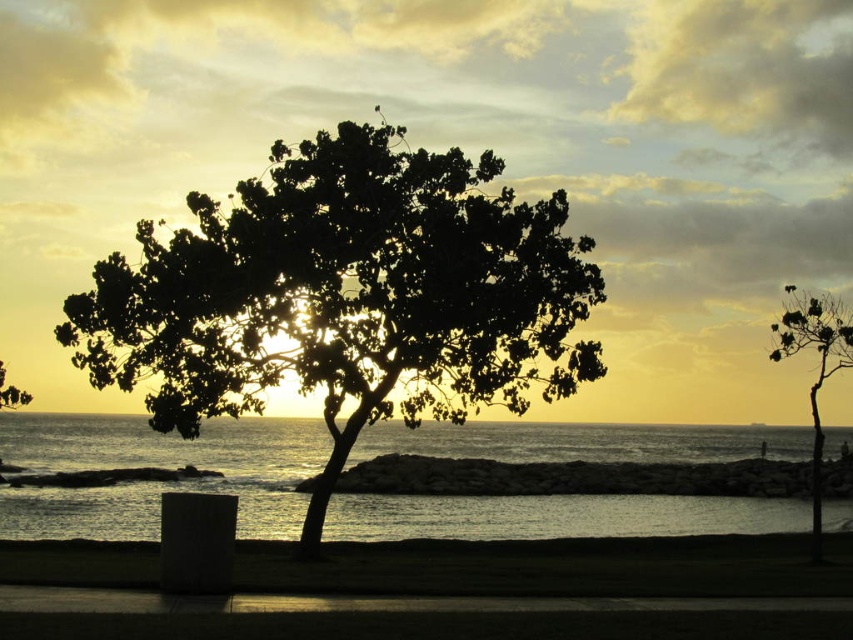
You are a photographer trying to capture the sunset. You notice the silhouette leafy tree at center and the silvery water at center. Which object is positioned higher in the scene?

The silhouette leafy tree at center is located above the silvery water at center, so it is positioned higher in the scene.

You are an artist trying to paint the coastal sunset scene. You notice the silhouette leafy tree at center and the silvery water at center. Which object in the scene has a narrower width?

The silhouette leafy tree at center is thinner than the silvery water at center, so the silhouette leafy tree at center has a narrower width.

You are a photographer trying to capture the reflection of the silvery water at center in your shot. Based on its position, where should you aim your camera to ensure the reflection is centered in the frame?

The silvery water at center is located at point 0.730 on the horizontal axis and 0.186 on the vertical axis. To center its reflection, aim your camera slightly to the right and lower down, aligning with these coordinates.